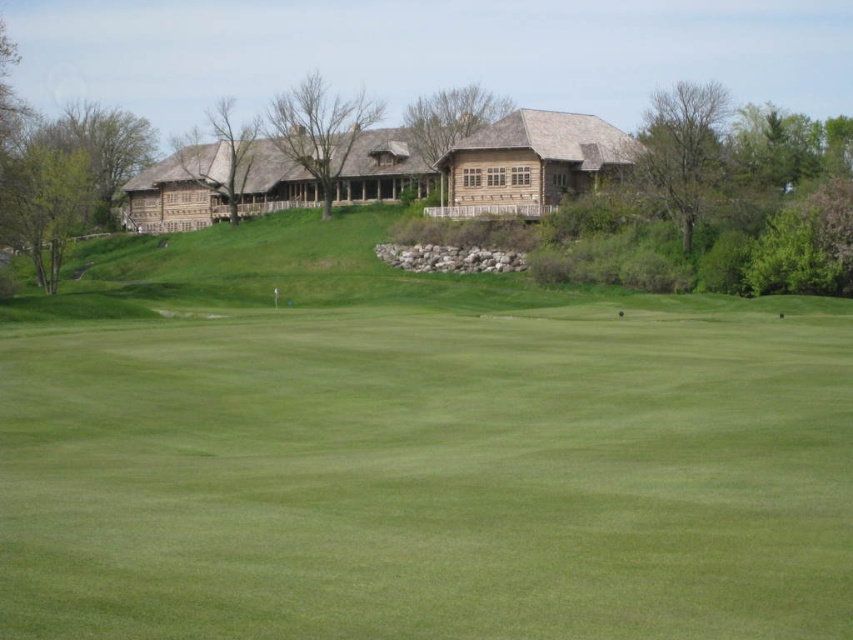
Can you confirm if green grass at upper center is positioned above wooden cabin at center?

Actually, green grass at upper center is below wooden cabin at center.

Can you confirm if green grass at upper center is positioned below wooden cabin at center?

Yes, green grass at upper center is below wooden cabin at center.

The height and width of the screenshot is (640, 853). What are the coordinates of `green grass at upper center` in the screenshot? It's located at (413, 451).

At what (x,y) coordinates should I click in order to perform the action: click on green grass at upper center. Please return your answer as a coordinate pair (x, y). Looking at the image, I should click on (413, 451).